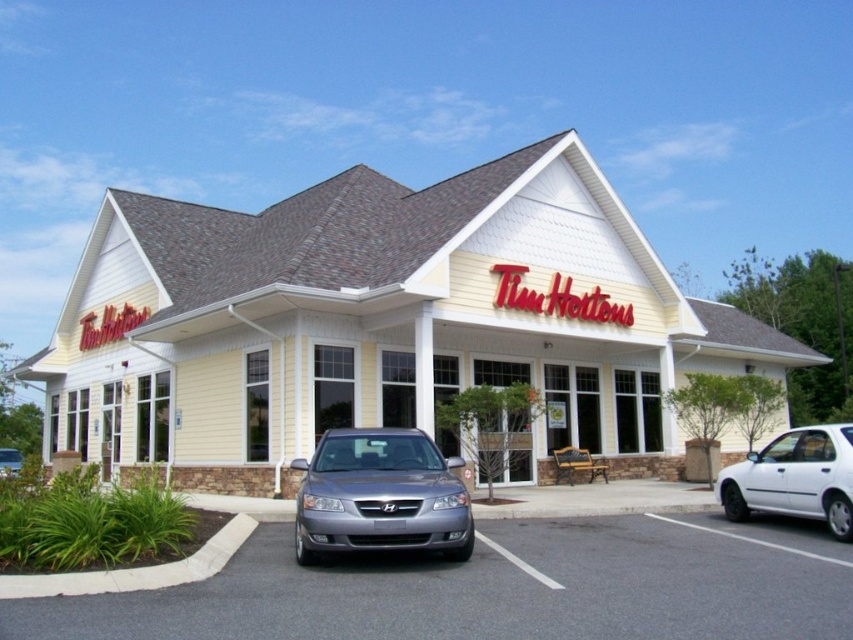
The image size is (853, 640). Find the location of `white matte car at lower right`. white matte car at lower right is located at coordinates (795, 477).

Can you confirm if white matte car at lower right is wider than satin silver sedan at lower left?

No.

Identify the location of white matte car at lower right. (795, 477).

Is point (601, 525) less distant than point (730, 515)?

Yes, point (601, 525) is closer to viewer.

Locate an element on the screen. The image size is (853, 640). gray asphalt parking lot at center is located at coordinates (497, 588).

Who is more distant from viewer, (532, 518) or (793, 448)?

Positioned behind is point (532, 518).

Where is `gray asphalt parking lot at center`? The image size is (853, 640). gray asphalt parking lot at center is located at coordinates (497, 588).

Between satin metallic sedan at center and white matte car at lower right, which one appears on the right side from the viewer's perspective?

From the viewer's perspective, white matte car at lower right appears more on the right side.

Image resolution: width=853 pixels, height=640 pixels. What are the coordinates of `satin metallic sedan at center` in the screenshot? It's located at (380, 496).

Find the location of `satin metallic sedan at center`. satin metallic sedan at center is located at coordinates (380, 496).

Locate an element on the screen. satin metallic sedan at center is located at coordinates (380, 496).